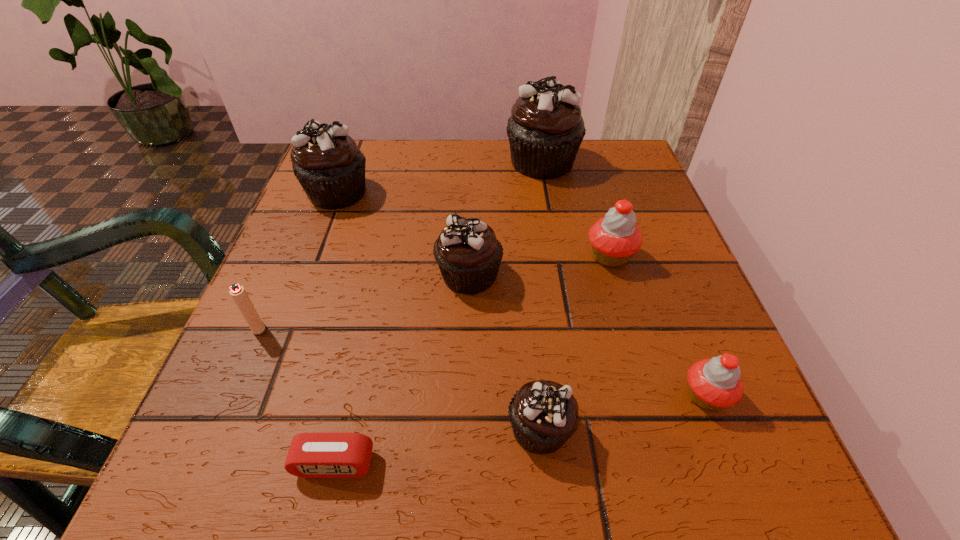
This screenshot has width=960, height=540. I want to click on blank region between the igniter and the tallest object, so click(x=400, y=245).

At what (x,y) coordinates should I click in order to perform the action: click on free spot between the leftmost cupcake and the smallest brown cupcake. Please return your answer as a coordinate pair (x, y). The width and height of the screenshot is (960, 540). Looking at the image, I should click on (439, 310).

I want to click on vacant area between the smallest brown cupcake and the shortest object, so tap(437, 446).

Select which object appears as the fourth closest to the farther red cupcake. Please provide its 2D coordinates. Your answer should be formatted as a tuple, i.e. [(x, y)], where the tuple contains the x and y coordinates of a point satisfying the conditions above.

[(543, 414)]

Locate which object is the closest to the biggest brown cupcake. Please provide its 2D coordinates. Your answer should be formatted as a tuple, i.e. [(x, y)], where the tuple contains the x and y coordinates of a point satisfying the conditions above.

[(615, 238)]

Image resolution: width=960 pixels, height=540 pixels. I want to click on cupcake that stands as the third closest to the tallest cupcake, so click(330, 167).

At what (x,y) coordinates should I click in order to perform the action: click on cupcake identified as the third closest to the third biggest brown cupcake. Please return your answer as a coordinate pair (x, y). The height and width of the screenshot is (540, 960). Looking at the image, I should click on (330, 167).

Where is `brown cupcake that is the third closest to the smaller red cupcake`? brown cupcake that is the third closest to the smaller red cupcake is located at coordinates (545, 130).

Find the location of a particular element. This screenshot has height=540, width=960. brown cupcake that stands as the closest to the nearest brown cupcake is located at coordinates (468, 254).

Identify the location of blank area in the image that satisfies the following two spatial constraints: 1. on the front side of the second nearest brown cupcake; 2. on the left side of the nearest brown cupcake. (466, 428).